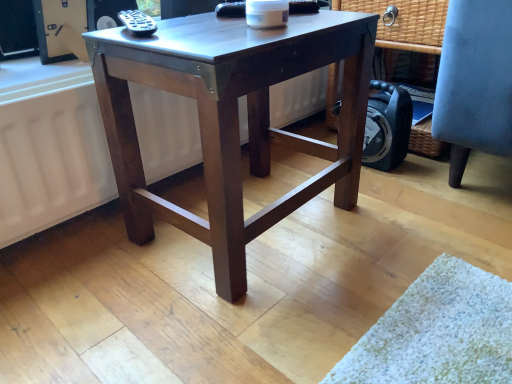
The height and width of the screenshot is (384, 512). Describe the element at coordinates (232, 119) in the screenshot. I see `dark wood table at center` at that location.

This screenshot has height=384, width=512. Find the location of `dark wood table at center`. dark wood table at center is located at coordinates (232, 119).

Where is `dark wood table at center`? Image resolution: width=512 pixels, height=384 pixels. dark wood table at center is located at coordinates (232, 119).